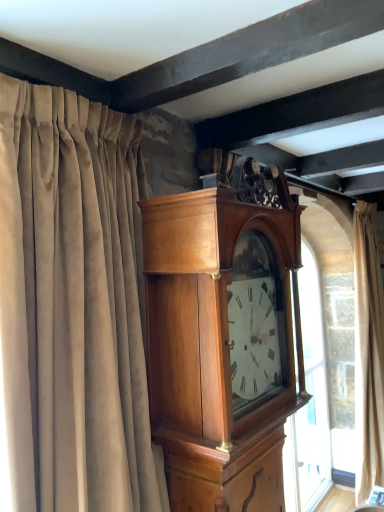
Question: Relative to beige velvet curtain at right, placed as the 1th curtain when sorted from right to left, is polished wood wall clock at center in front or behind?

Choices:
 (A) behind
 (B) front

Answer: (B)

Question: Is polished wood wall clock at center situated inside beige velvet curtain at right, which ranks as the 2th curtain in front-to-back order, or outside?

Choices:
 (A) inside
 (B) outside

Answer: (B)

Question: Estimate the real-world distances between objects in this image. Which object is closer to the polished wood wall clock at center?

Choices:
 (A) suede curtain at left, which ranks as the second curtain in right-to-left order
 (B) beige velvet curtain at right, placed as the 1th curtain when sorted from right to left

Answer: (A)

Question: Estimate the real-world distances between objects in this image. Which object is closer to the polished wood wall clock at center?

Choices:
 (A) suede curtain at left, which ranks as the 1th curtain in left-to-right order
 (B) beige velvet curtain at right, the first curtain positioned from the back

Answer: (A)